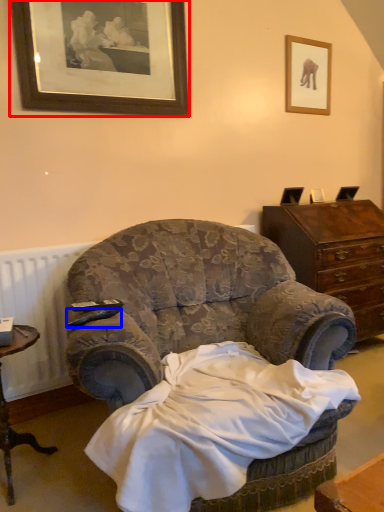
Question: Which point is closer to the camera, picture frame (highlighted by a red box) or remote control (highlighted by a blue box)?

Choices:
 (A) picture frame
 (B) remote control

Answer: (B)